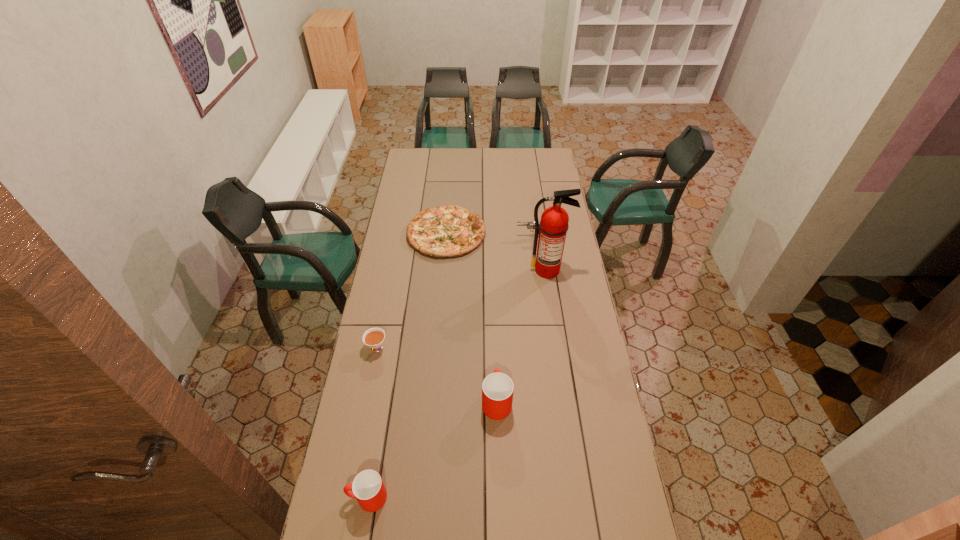
Where is `cup that is positioned at the left edge`? The height and width of the screenshot is (540, 960). cup that is positioned at the left edge is located at coordinates (368, 488).

Where is `teacup that is at the left edge`? Image resolution: width=960 pixels, height=540 pixels. teacup that is at the left edge is located at coordinates (374, 337).

The image size is (960, 540). What are the coordinates of `pizza located in the left edge section of the desktop` in the screenshot? It's located at (447, 231).

Identify the location of pistol that is at the right edge. This screenshot has width=960, height=540. (x=530, y=225).

What are the coordinates of `fire extinguisher that is positioned at the right edge` in the screenshot? It's located at (553, 226).

Find the location of a particular element. Image resolution: width=960 pixels, height=540 pixels. object situated at the near left corner is located at coordinates (368, 488).

Identify the location of vacant region at the far edge of the desktop. (499, 163).

The width and height of the screenshot is (960, 540). I want to click on vacant region at the left edge, so click(405, 267).

You are a GUI agent. You are given a task and a screenshot of the screen. Output one action in this format:
    pyautogui.click(x=<x>, y=<y>)
    Task: Click on the free space at the right edge of the desktop
    The height and width of the screenshot is (540, 960).
    Given the screenshot: What is the action you would take?
    pyautogui.click(x=559, y=182)

This screenshot has width=960, height=540. I want to click on free space at the far left corner of the desktop, so click(428, 148).